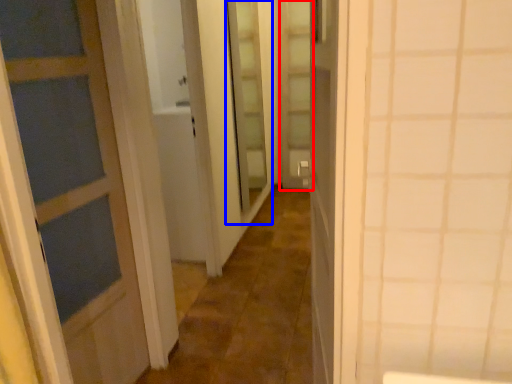
Question: Which object appears closest to the camera in this image, screen door (highlighted by a red box) or screen door (highlighted by a blue box)?

Choices:
 (A) screen door
 (B) screen door

Answer: (B)